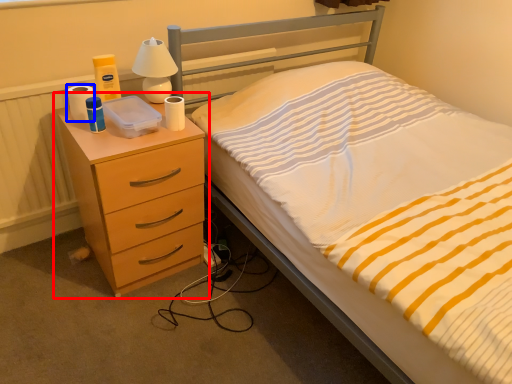
Question: Which object is closer to the camera taking this photo, chest of drawers (highlighted by a red box) or toilet paper (highlighted by a blue box)?

Choices:
 (A) chest of drawers
 (B) toilet paper

Answer: (A)